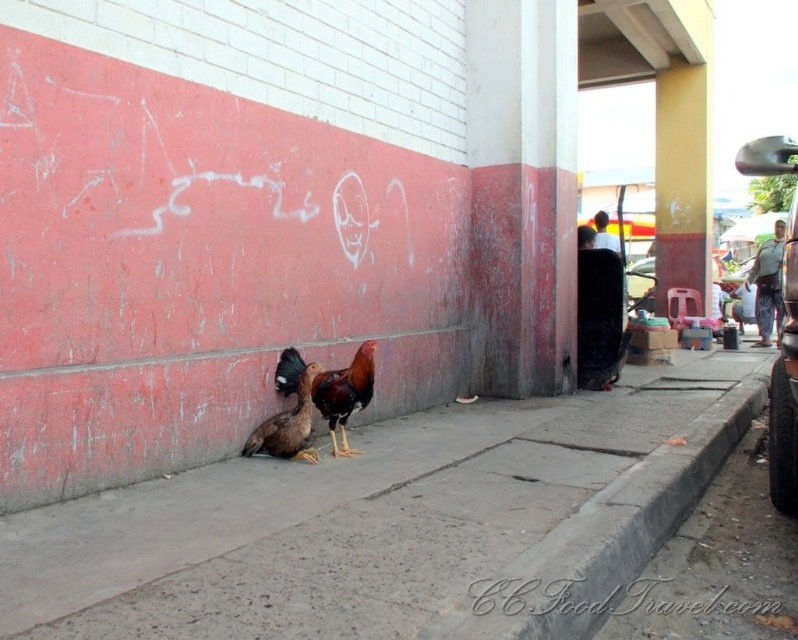
Question: Which of the following is the closest to the observer?

Choices:
 (A) gray concrete pavement at lower center
 (B) denim jacket at lower right

Answer: (A)

Question: Is gray concrete pavement at lower center below denim jacket at lower right?

Choices:
 (A) no
 (B) yes

Answer: (B)

Question: Can you confirm if metallic gray car at right is wider than brown feathered chicken at center?

Choices:
 (A) no
 (B) yes

Answer: (B)

Question: Which of the following is the farthest from the observer?

Choices:
 (A) (769, 476)
 (B) (457, 499)
 (C) (488, 582)

Answer: (A)

Question: Which of these objects is positioned closest to the gray concrete pavement at lower center?

Choices:
 (A) metallic gray car at right
 (B) white shirt at center

Answer: (A)

Question: Is the position of gray concrete pavement at lower center more distant than that of brown feathered chicken at center?

Choices:
 (A) no
 (B) yes

Answer: (A)